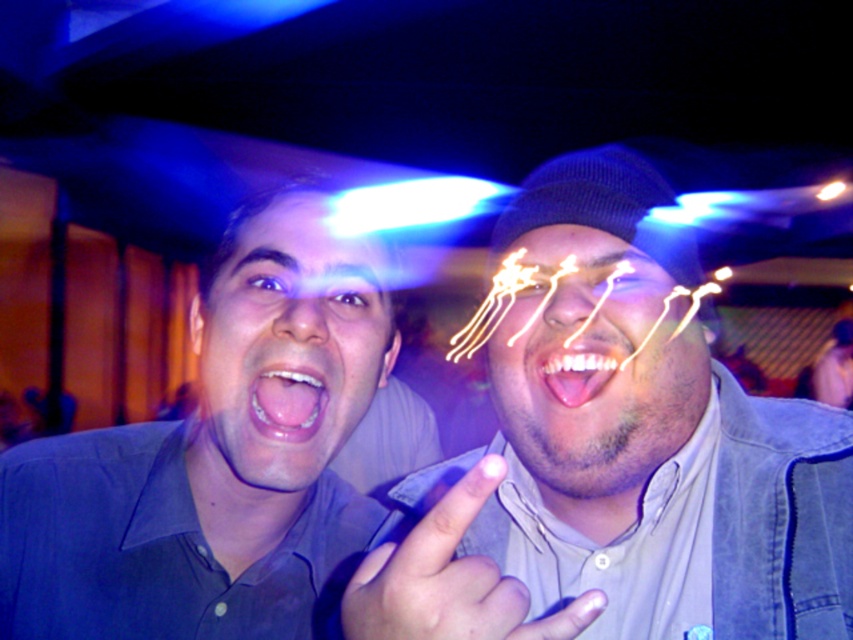
Looking at this image, who is higher up, shiny metallic face at center or smooth pink tongue at center?

Positioned higher is shiny metallic face at center.

Can you confirm if shiny metallic face at center is shorter than smooth pink tongue at center?

In fact, shiny metallic face at center may be taller than smooth pink tongue at center.

Is point (630, 420) closer to camera compared to point (306, 422)?

Yes, it is.

The width and height of the screenshot is (853, 640). I want to click on shiny metallic face at center, so [595, 368].

Who is lower down, denim jacket at right or smooth pink tongue at center?

denim jacket at right is below.

Is point (706, 545) closer to viewer compared to point (250, 392)?

No, it is behind (250, 392).

Measure the distance between denim jacket at right and camera.

35.95 centimeters

Find the location of a particular element. The image size is (853, 640). denim jacket at right is located at coordinates (614, 458).

Who is shorter, shiny metallic face at center or pink glossy tongue at center?

With less height is pink glossy tongue at center.

Which of these two, shiny metallic face at center or pink glossy tongue at center, stands taller?

Standing taller between the two is shiny metallic face at center.

Does point (630, 296) come closer to viewer compared to point (544, 381)?

No, (630, 296) is behind (544, 381).

Find the location of a particular element. The height and width of the screenshot is (640, 853). shiny metallic face at center is located at coordinates (595, 368).